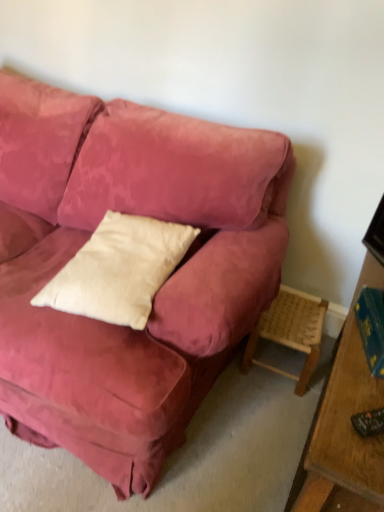
Locate an element on the screen. The height and width of the screenshot is (512, 384). white cotton pillow at center is located at coordinates (119, 269).

Measure the distance between white cotton pillow at center and camera.

3.56 feet.

This screenshot has height=512, width=384. What do you see at coordinates (290, 331) in the screenshot? I see `woven wood stool at lower right` at bounding box center [290, 331].

You are a GUI agent. You are given a task and a screenshot of the screen. Output one action in this format:
    pyautogui.click(x=<x>, y=<y>)
    Task: Click on the hardcover book at right
    
    Given the screenshot: What is the action you would take?
    pyautogui.click(x=372, y=327)

Is hardcover book at right at the left side of woven wood stool at lower right?

No.

Between hardcover book at right and woven wood stool at lower right, which one has larger size?

woven wood stool at lower right is bigger.

Can you confirm if hardcover book at right is positioned to the right of white cotton pillow at center?

Indeed, hardcover book at right is positioned on the right side of white cotton pillow at center.

Between hardcover book at right and white cotton pillow at center, which one is positioned in front?

white cotton pillow at center.

This screenshot has width=384, height=512. Identify the location of book behind the white cotton pillow at center. (372, 327).

Is woven wood stool at lower right not close to white cotton pillow at center?

woven wood stool at lower right is actually quite close to white cotton pillow at center.

From a real-world perspective, is woven wood stool at lower right under white cotton pillow at center?

Yes, from a real-world perspective, woven wood stool at lower right is beneath white cotton pillow at center.

The image size is (384, 512). I want to click on pillow located above the woven wood stool at lower right (from the image's perspective), so click(119, 269).

How many degrees apart are the facing directions of woven wood stool at lower right and white cotton pillow at center?

93.8 degrees separate the facing orientations of woven wood stool at lower right and white cotton pillow at center.

From the image's perspective, is white cotton pillow at center located above woven wood stool at lower right?

Yes.

In terms of height, does white cotton pillow at center look taller or shorter compared to woven wood stool at lower right?

In the image, white cotton pillow at center appears to be shorter than woven wood stool at lower right.

Is white cotton pillow at center further to the viewer compared to woven wood stool at lower right?

No, white cotton pillow at center is closer to the camera.

Between white cotton pillow at center and woven wood stool at lower right, which one has larger width?

Wider between the two is white cotton pillow at center.

From the picture: Is woven wood stool at lower right positioned behind hardcover book at right?

Yes, woven wood stool at lower right is further from the camera.

How many degrees apart are the facing directions of woven wood stool at lower right and hardcover book at right?

They differ by 77 degrees in their facing directions.

Does woven wood stool at lower right appear on the left side of hardcover book at right?

Yes.

Is white cotton pillow at center facing towards hardcover book at right?

No, white cotton pillow at center is not turned towards hardcover book at right.

From the picture: Is white cotton pillow at center at the left side of hardcover book at right?

Yes.

In the scene shown: Is white cotton pillow at center positioned in front of hardcover book at right?

Yes, white cotton pillow at center is closer to the camera.

Locate an element on the screen. The width and height of the screenshot is (384, 512). book that appears in front of the woven wood stool at lower right is located at coordinates (372, 327).

This screenshot has width=384, height=512. What are the coordinates of `book below the white cotton pillow at center (from the image's perspective)` in the screenshot? It's located at (372, 327).

Based on their spatial positions, is hardcover book at right or woven wood stool at lower right closer to white cotton pillow at center?

Based on the image, hardcover book at right appears to be nearer to white cotton pillow at center.

From the image, which object appears to be nearer to hardcover book at right, white cotton pillow at center or woven wood stool at lower right?

woven wood stool at lower right.

When comparing their distances from woven wood stool at lower right, does white cotton pillow at center or hardcover book at right seem closer?

hardcover book at right lies closer to woven wood stool at lower right than the other object.

Estimate the real-world distances between objects in this image. Which object is closer to woven wood stool at lower right, hardcover book at right or white cotton pillow at center?

The object closer to woven wood stool at lower right is hardcover book at right.

Considering their positions, is woven wood stool at lower right positioned further to white cotton pillow at center than hardcover book at right?

woven wood stool at lower right is further to white cotton pillow at center.

Based on their spatial positions, is woven wood stool at lower right or white cotton pillow at center further from hardcover book at right?

Among the two, white cotton pillow at center is located further to hardcover book at right.

Find the location of a particular element. The image size is (384, 512). side table located between white cotton pillow at center and hardcover book at right in the left-right direction is located at coordinates (290, 331).